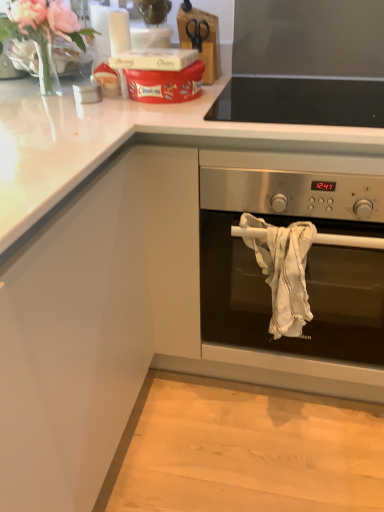
What do you see at coordinates (301, 101) in the screenshot?
I see `black glass cooktop at upper center` at bounding box center [301, 101].

Locate an element on the screen. black glass cooktop at upper center is located at coordinates (301, 101).

In order to face black glass cooktop at upper center, should I rotate leftwards or rightwards?

A 15.311 degree turn to the right will do.

Find the location of a particular element. This screenshot has width=384, height=512. black glass cooktop at upper center is located at coordinates (301, 101).